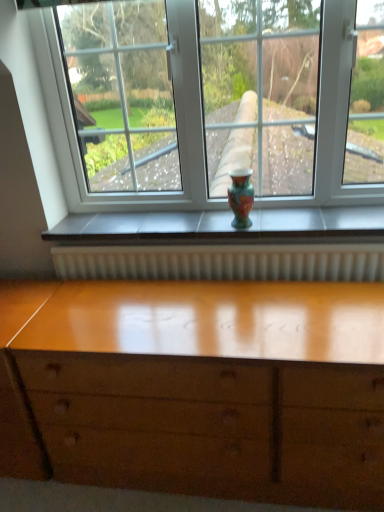
Question: Could you tell me if multicolored glossy vase at center is facing glossy wood chest of drawers at lower center?

Choices:
 (A) yes
 (B) no

Answer: (B)

Question: Is multicolored glossy vase at center not within glossy wood chest of drawers at lower center?

Choices:
 (A) yes
 (B) no

Answer: (A)

Question: Are multicolored glossy vase at center and glossy wood chest of drawers at lower center located far from each other?

Choices:
 (A) yes
 (B) no

Answer: (B)

Question: From a real-world perspective, is multicolored glossy vase at center positioned under glossy wood chest of drawers at lower center based on gravity?

Choices:
 (A) no
 (B) yes

Answer: (A)

Question: Can glossy wood chest of drawers at lower center be found inside multicolored glossy vase at center?

Choices:
 (A) no
 (B) yes

Answer: (A)

Question: Is multicolored glossy vase at center turned away from glossy wood chest of drawers at lower center?

Choices:
 (A) no
 (B) yes

Answer: (A)

Question: Is glossy wood chest of drawers at lower center far away from multicolored glossy vase at center?

Choices:
 (A) yes
 (B) no

Answer: (B)

Question: Does glossy wood chest of drawers at lower center have a lesser height compared to multicolored glossy vase at center?

Choices:
 (A) no
 (B) yes

Answer: (A)

Question: From a real-world perspective, is glossy wood chest of drawers at lower center physically above multicolored glossy vase at center?

Choices:
 (A) no
 (B) yes

Answer: (A)

Question: Is glossy wood chest of drawers at lower center to the right of multicolored glossy vase at center from the viewer's perspective?

Choices:
 (A) no
 (B) yes

Answer: (A)

Question: Could you tell me if glossy wood chest of drawers at lower center is turned towards multicolored glossy vase at center?

Choices:
 (A) yes
 (B) no

Answer: (B)

Question: Is glossy wood chest of drawers at lower center smaller than multicolored glossy vase at center?

Choices:
 (A) no
 (B) yes

Answer: (A)

Question: From their relative heights in the image, would you say glossy wood chest of drawers at lower center is taller or shorter than multicolored glossy vase at center?

Choices:
 (A) short
 (B) tall

Answer: (B)